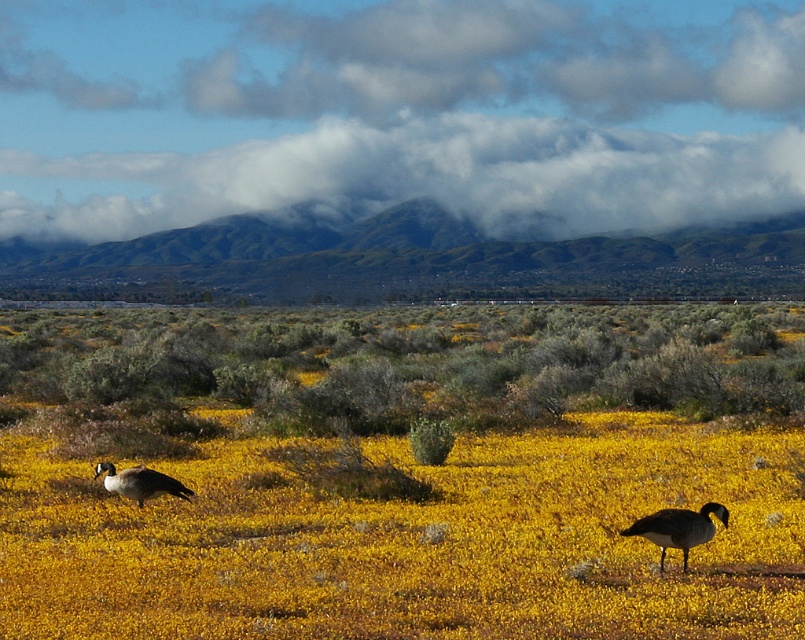
You are a photographer standing in the field of yellow flowers and want to capture a clear photo of the dark gray goose at lower left. However, the yellow matte flower at lower left is blocking your view. Can you adjust your position to avoid the flower while still keeping the goose in frame?

The yellow matte flower at lower left is positioned under the dark gray goose at lower left. Since the flower is beneath the goose, moving your camera angle slightly upward or shifting your position to the side might allow you to capture the goose without the flower obstructing the view.

You are a photographer standing in the middle of the yellow matte flower field. You want to take a photo of the dark gray matte goose at lower right without the yellow matte flower at lower left blocking the view. Is this possible?

The yellow matte flower at lower left is below the dark gray matte goose at lower right, so the flower is positioned lower than the goose. Since you are standing in the middle of the field, the flower at lower left would not block the view of the goose at lower right as they are at different vertical positions.